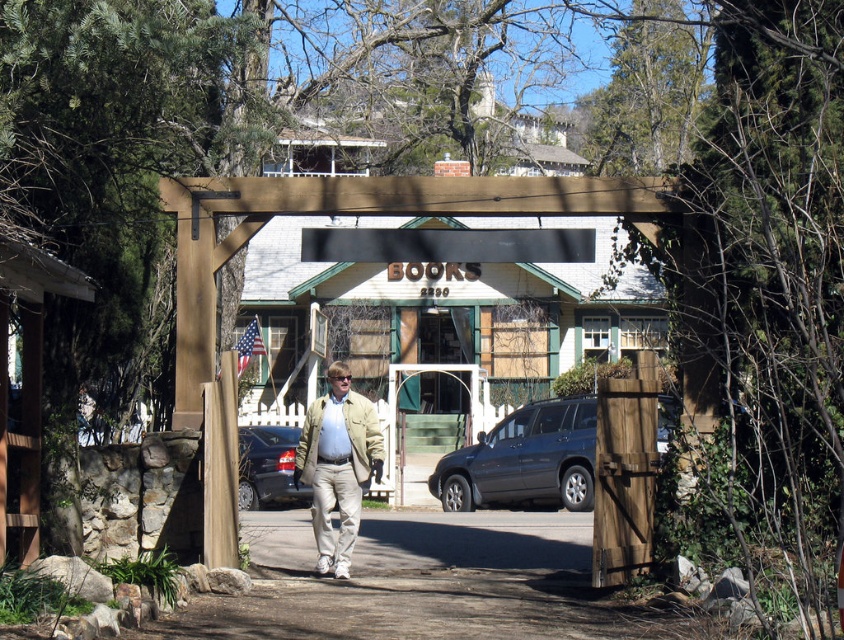
You are standing at the entrance of the BOOKS building and see the point at coordinates [472,540]. What is located at that point?

The gray asphalt pavement at center is located at point [472,540].

You are standing outside the wooden gate of the BOOKS building. You see a matte dark blue suv at center and a tan fabric jacket at center. Which object is closer to you?

The matte dark blue suv at center is closer to you because it is in front of the tan fabric jacket at center.